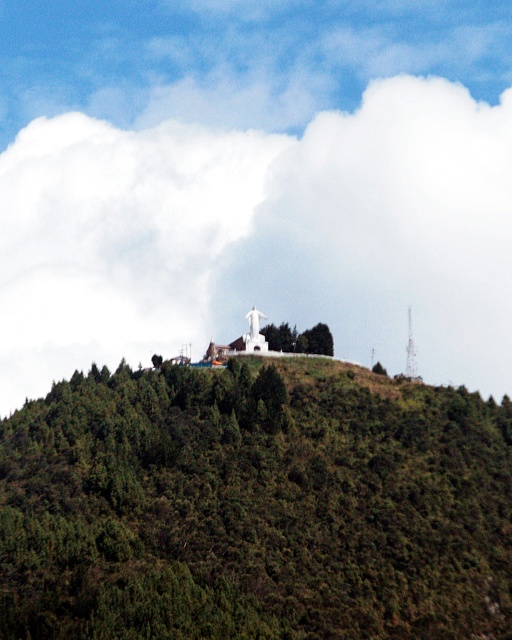
Who is higher up, green textured hillside at center or white fluffy cloud at upper center?

white fluffy cloud at upper center is higher up.

Is point (373, 422) farther from viewer compared to point (355, 314)?

No, it is in front of (355, 314).

Identify the location of green textured hillside at center. The height and width of the screenshot is (640, 512). (254, 506).